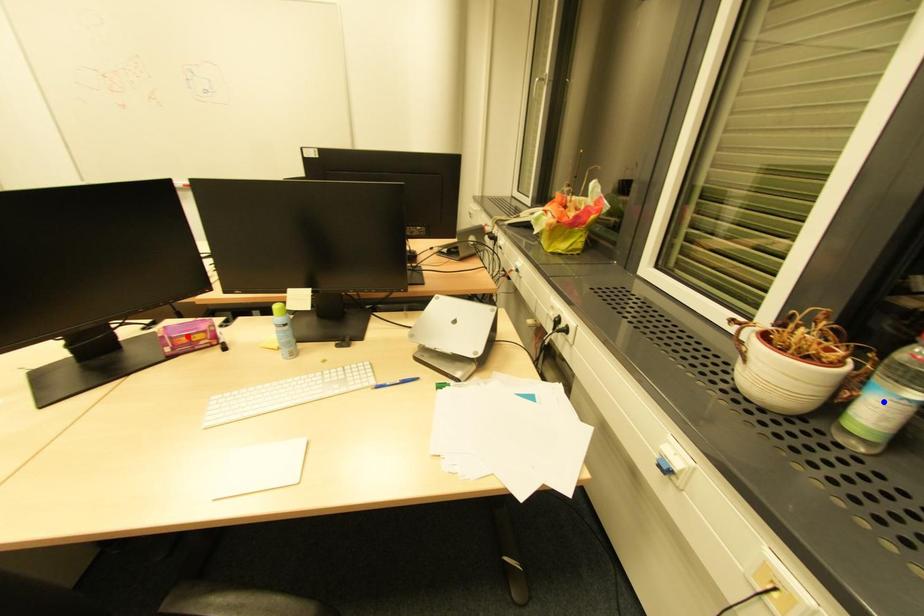
Question: Which of the two points in the image is closer to the camera?

Choices:
 (A) Blue point is closer.
 (B) Red point is closer.

Answer: (A)